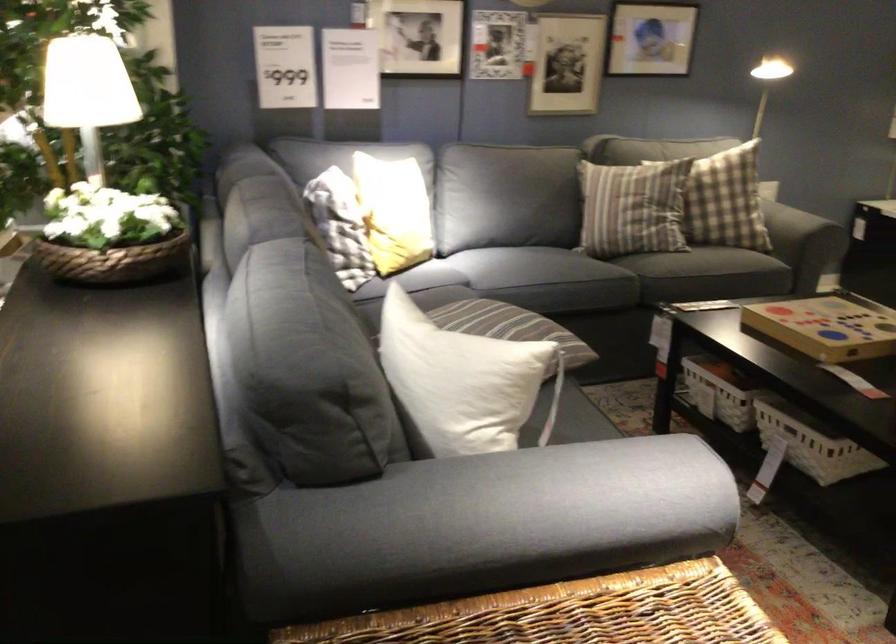
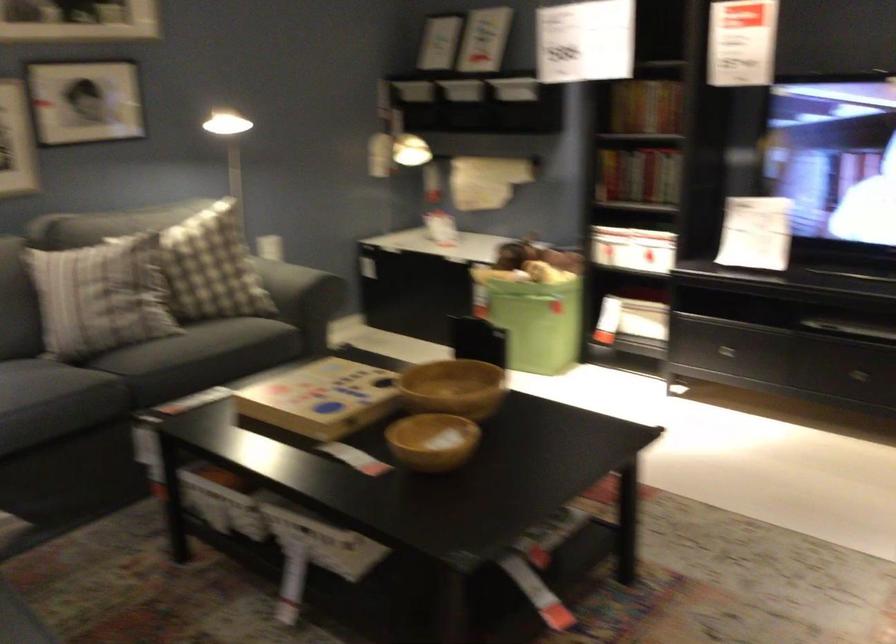
Question: The first image is from the beginning of the video and the second image is from the end. How did the camera likely rotate when shooting the video?

Choices:
 (A) Left
 (B) Right
 (C) Up
 (D) Down

Answer: (B)